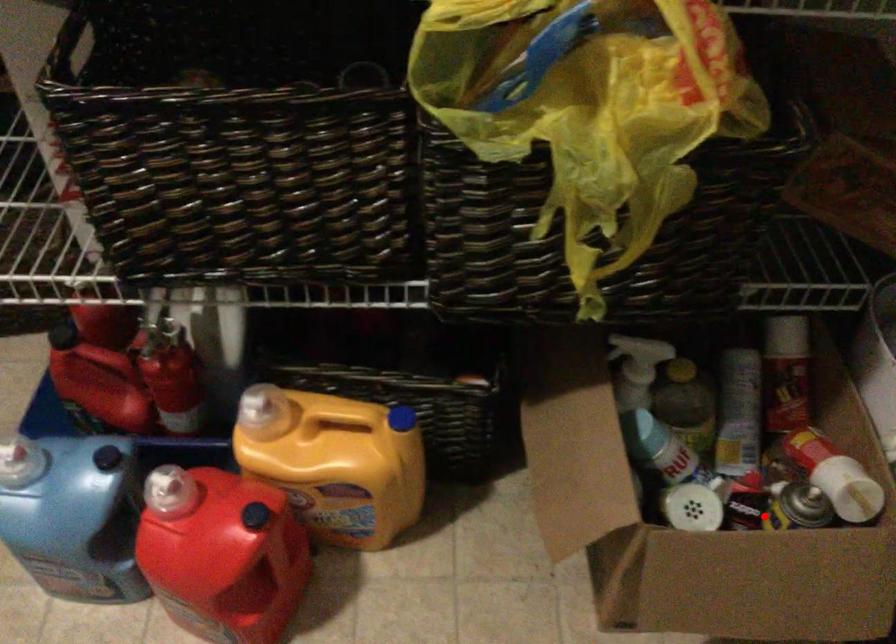
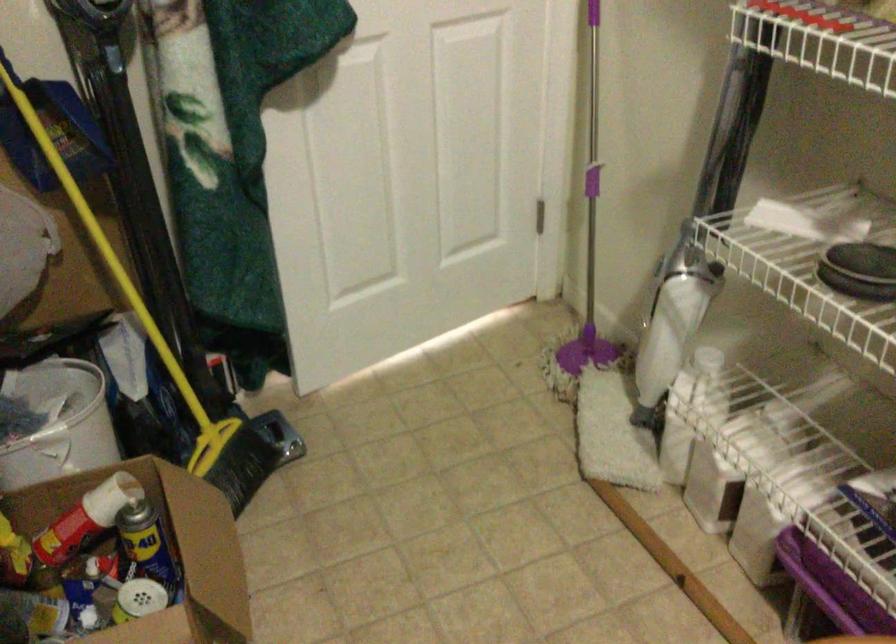
Question: A red point is marked in image1. In image2, is the corresponding 3D point closer to the camera or farther? Reply with the corresponding letter.

Choices:
 (A) The corresponding 3D point is closer.
 (B) The corresponding 3D point is farther.

Answer: (B)